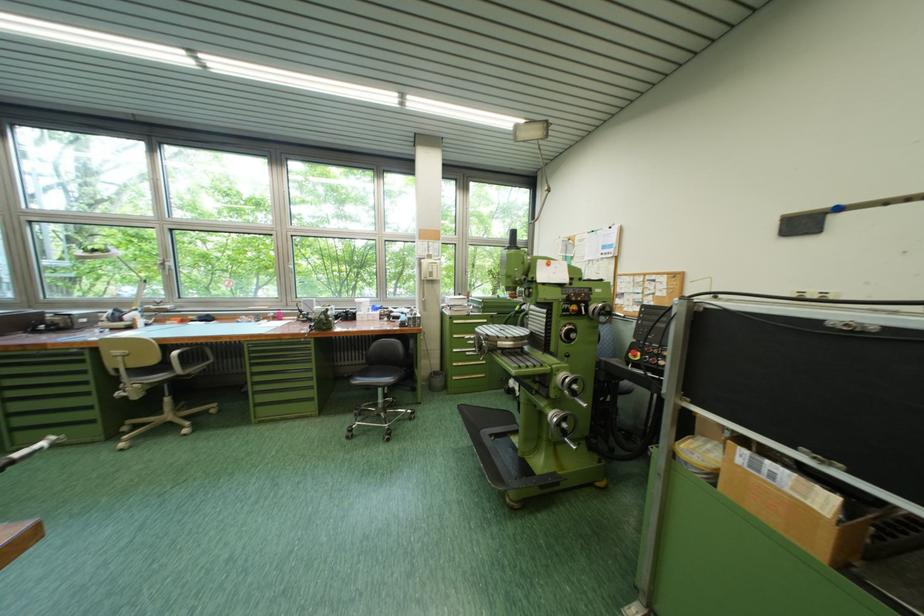
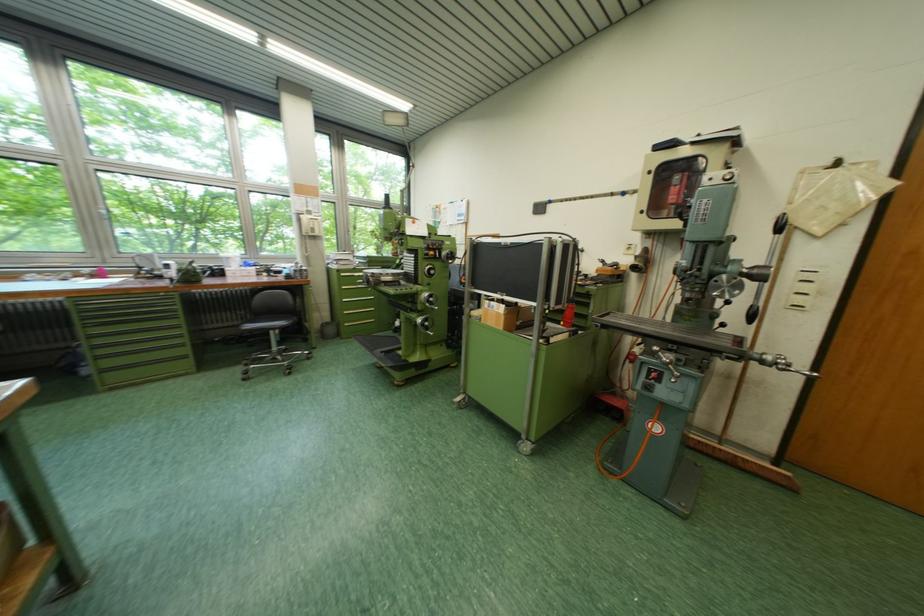
Where in the second image is the point corresponding to the point at 781,466 from the first image?

(503, 305)